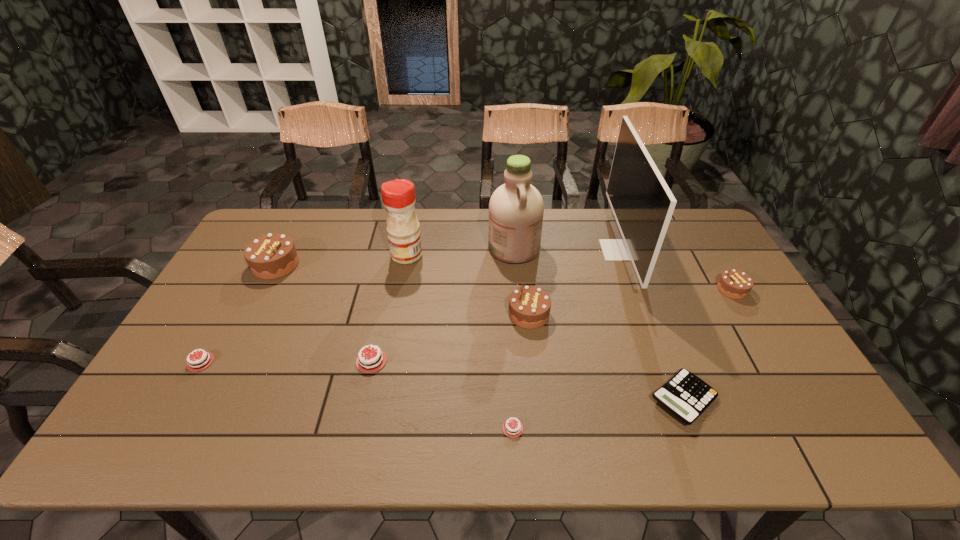
Locate an element on the screen. Image resolution: width=960 pixels, height=540 pixels. vacant area at the right edge is located at coordinates (759, 349).

The width and height of the screenshot is (960, 540). What are the coordinates of `free location at the near left corner` in the screenshot? It's located at (118, 446).

In the image, there is a desktop. Where is `vacant space at the far right corner`? This screenshot has width=960, height=540. vacant space at the far right corner is located at coordinates (693, 238).

Locate an element on the screen. Image resolution: width=960 pixels, height=540 pixels. vacant point located between the red condiment and the sixth shortest object is located at coordinates (468, 285).

This screenshot has height=540, width=960. What are the coordinates of `vacant area that lies between the calculator and the rightmost red chocolate cake` in the screenshot? It's located at (598, 414).

Where is `vacant region between the second smallest brown chocolate cake and the calculator`? The height and width of the screenshot is (540, 960). vacant region between the second smallest brown chocolate cake and the calculator is located at coordinates (606, 356).

You are a GUI agent. You are given a task and a screenshot of the screen. Output one action in this format:
    pyautogui.click(x=<x>, y=<y>)
    Task: Click on the free space between the biggest brown chocolate cake and the sixth shortest object
    This screenshot has height=540, width=960.
    Given the screenshot: What is the action you would take?
    pyautogui.click(x=402, y=289)

Find the location of a particular element. The image size is (960, 540). empty space that is in between the second shortest chocolate cake and the rightmost object is located at coordinates (467, 326).

Where is `free space between the second biggest brown chocolate cake and the cleansing agent`? This screenshot has width=960, height=540. free space between the second biggest brown chocolate cake and the cleansing agent is located at coordinates (521, 281).

Image resolution: width=960 pixels, height=540 pixels. In order to click on free point between the rightmost object and the calculator in this screenshot , I will do `click(708, 345)`.